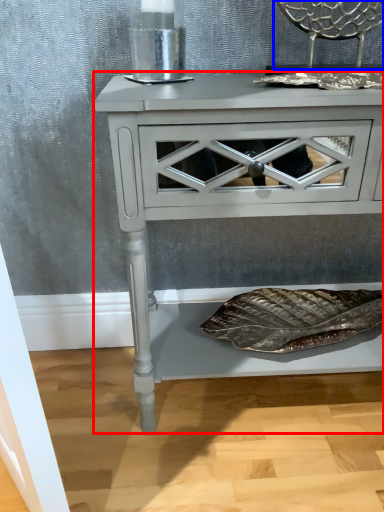
Question: Which object is further to the camera taking this photo, nightstand (highlighted by a red box) or chair (highlighted by a blue box)?

Choices:
 (A) nightstand
 (B) chair

Answer: (B)